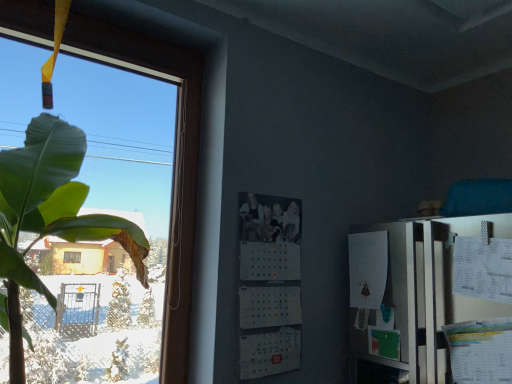
Question: From the image's perspective, is transparent glass window at left located beneath white matte calendar at center?

Choices:
 (A) yes
 (B) no

Answer: (B)

Question: Would you consider transparent glass window at left to be distant from white matte calendar at center?

Choices:
 (A) yes
 (B) no

Answer: (B)

Question: Is the depth of transparent glass window at left less than that of white matte calendar at center?

Choices:
 (A) no
 (B) yes

Answer: (B)

Question: From a real-world perspective, is transparent glass window at left on top of white matte calendar at center?

Choices:
 (A) yes
 (B) no

Answer: (A)

Question: Is transparent glass window at left further to camera compared to white matte calendar at center?

Choices:
 (A) yes
 (B) no

Answer: (B)

Question: Does transparent glass window at left touch white matte calendar at center?

Choices:
 (A) no
 (B) yes

Answer: (A)

Question: Can you see white matte calendar at center touching transparent glass window at left?

Choices:
 (A) no
 (B) yes

Answer: (A)

Question: Would you say white matte calendar at center is outside transparent glass window at left?

Choices:
 (A) no
 (B) yes

Answer: (B)

Question: Is white matte calendar at center wider than transparent glass window at left?

Choices:
 (A) no
 (B) yes

Answer: (A)

Question: Is white matte calendar at center in front of transparent glass window at left?

Choices:
 (A) no
 (B) yes

Answer: (A)

Question: Is white matte calendar at center shorter than transparent glass window at left?

Choices:
 (A) yes
 (B) no

Answer: (A)

Question: Is white matte calendar at center oriented towards transparent glass window at left?

Choices:
 (A) no
 (B) yes

Answer: (A)

Question: Would you say white matte calendar at center is to the left or to the right of transparent glass window at left in the picture?

Choices:
 (A) left
 (B) right

Answer: (B)